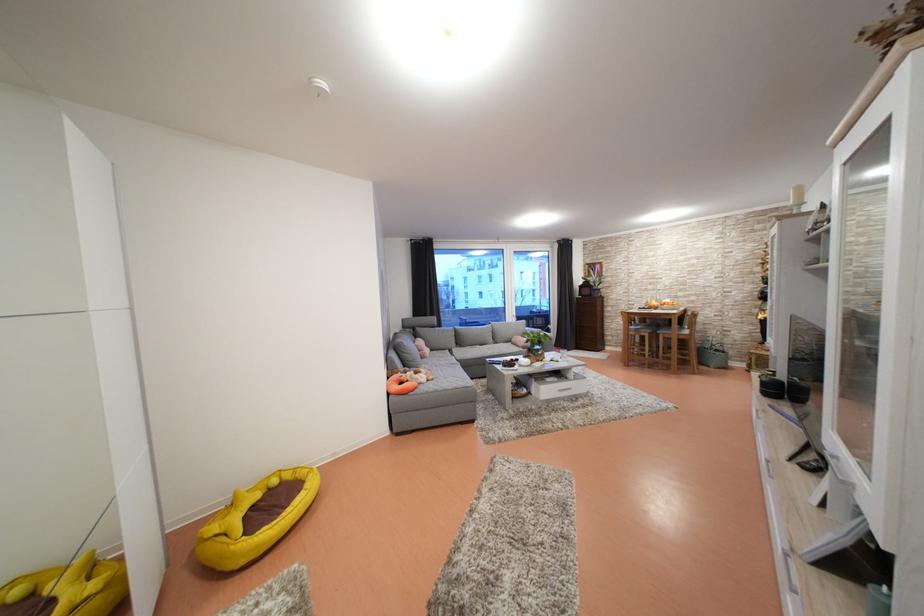
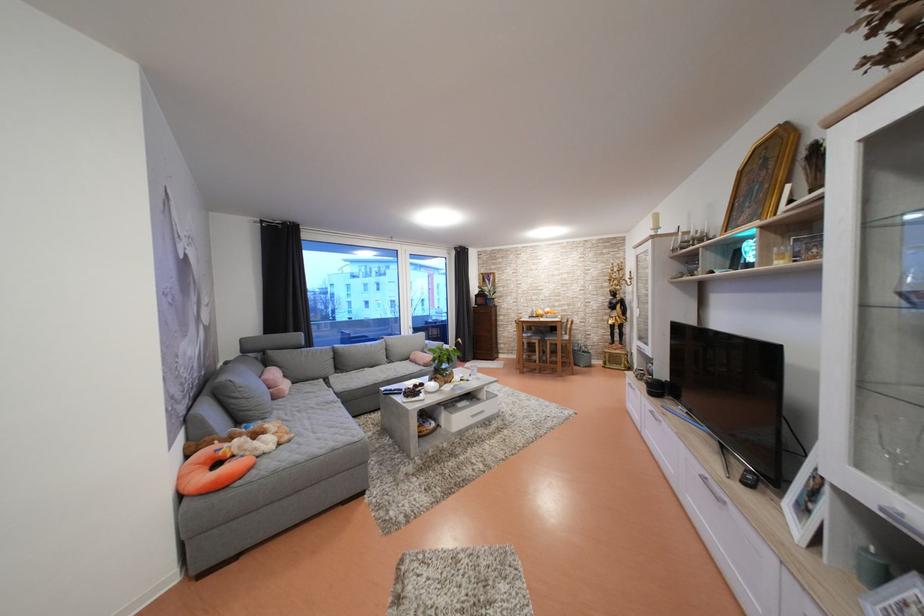
The point at (x=775, y=467) is marked in the first image. Where is the corresponding point in the second image?

(711, 484)